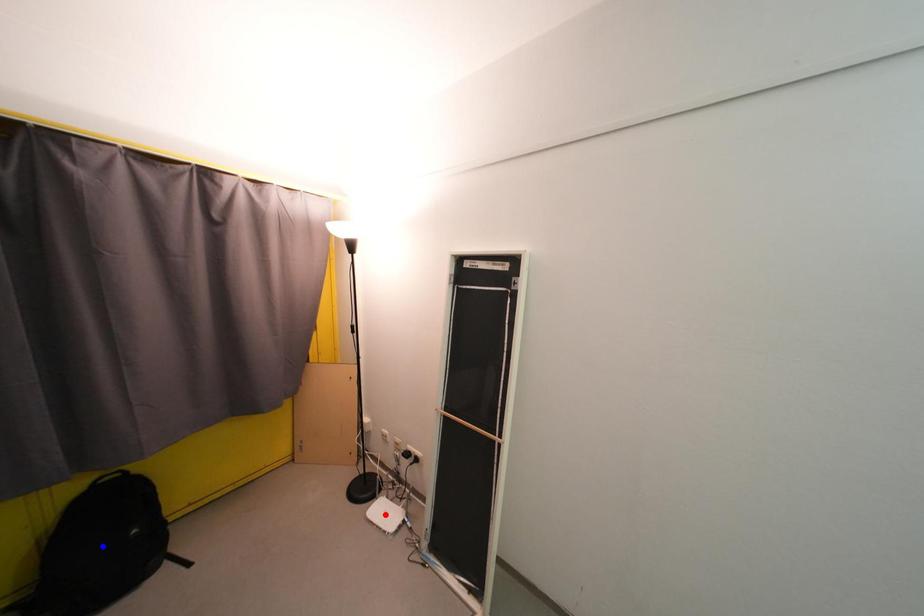
Question: In the image, two points are highlighted. Which point is nearer to the camera? Reply with the corresponding letter.

Choices:
 (A) blue point
 (B) red point

Answer: (A)